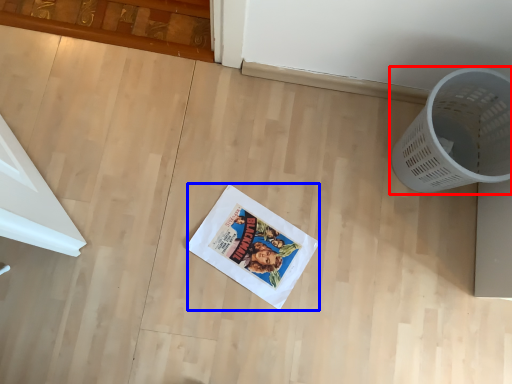
Question: Among these objects, which one is nearest to the camera, waste container (highlighted by a red box) or comic book (highlighted by a blue box)?

Choices:
 (A) waste container
 (B) comic book

Answer: (A)